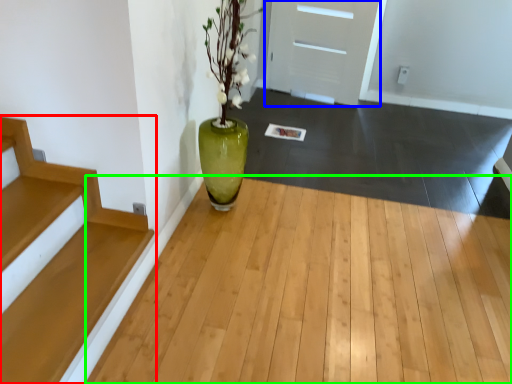
Question: Estimate the real-world distances between objects in this image. Which object is farther from stairs (highlighted by a red box), door (highlighted by a blue box) or corridor (highlighted by a green box)?

Choices:
 (A) door
 (B) corridor

Answer: (A)